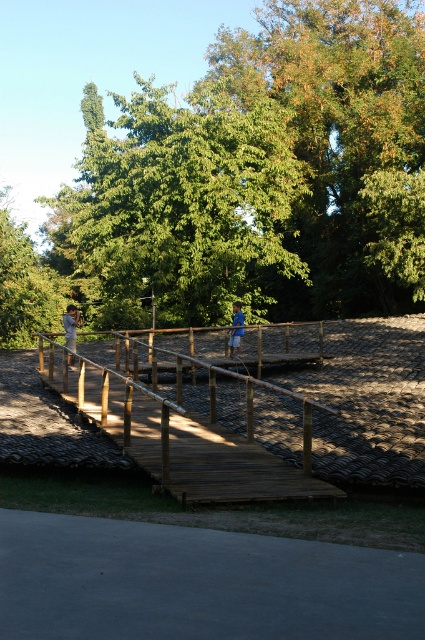
Question: Considering the relative positions of blue fabric shirt at center and blue cotton shirt at center in the image provided, where is blue fabric shirt at center located with respect to blue cotton shirt at center?

Choices:
 (A) below
 (B) above

Answer: (A)

Question: Which point is farther to the camera?

Choices:
 (A) blue cotton shirt at center
 (B) wooden bridge at center
 (C) gray concrete path at lower center
 (D) blue fabric shirt at center

Answer: (A)

Question: Which object appears closest to the camera in this image?

Choices:
 (A) blue fabric shirt at center
 (B) blue cotton shirt at center
 (C) gray concrete path at lower center

Answer: (C)

Question: Is wooden bridge at center above blue fabric shirt at center?

Choices:
 (A) yes
 (B) no

Answer: (B)

Question: Does gray concrete path at lower center appear under blue cotton shirt at center?

Choices:
 (A) no
 (B) yes

Answer: (B)

Question: Which object is positioned closest to the wooden bridge at center?

Choices:
 (A) blue cotton shirt at center
 (B) gray concrete path at lower center

Answer: (B)